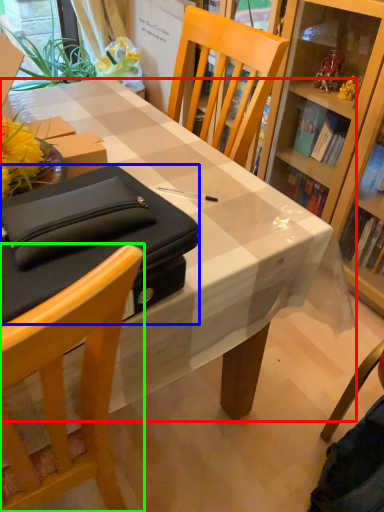
Question: Considering the real-world distances, which object is closest to desk (highlighted by a red box)? box (highlighted by a blue box) or chair (highlighted by a green box).

Choices:
 (A) box
 (B) chair

Answer: (A)